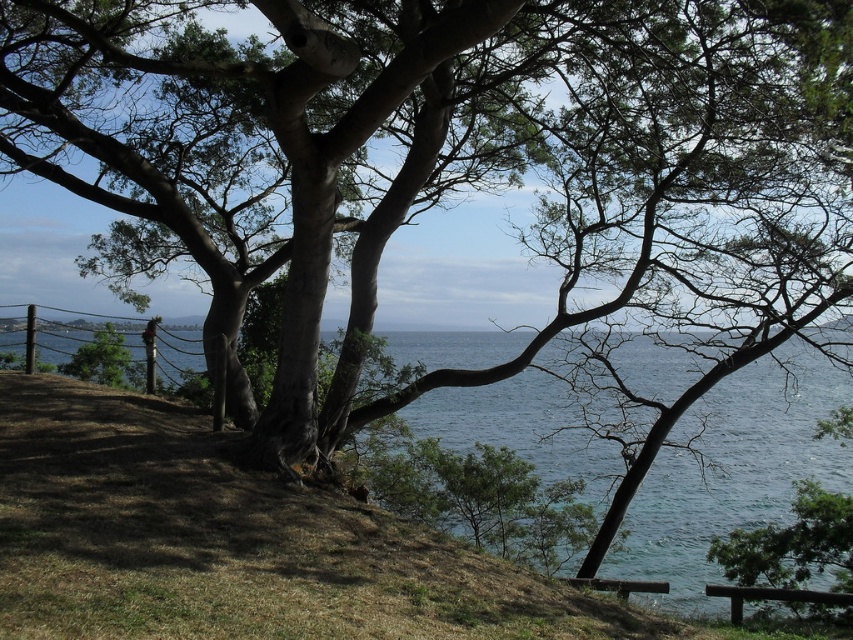
Is green leafy tree at lower right shorter than brown wooden bench at lower right?

In fact, green leafy tree at lower right may be taller than brown wooden bench at lower right.

Which is in front, point (735, 550) or point (734, 624)?

Point (734, 624) is in front.

The height and width of the screenshot is (640, 853). Identify the location of green leafy tree at lower right. (790, 554).